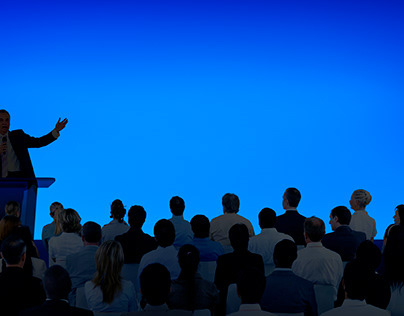
The width and height of the screenshot is (404, 316). Identify the location of pulpit. (20, 190).